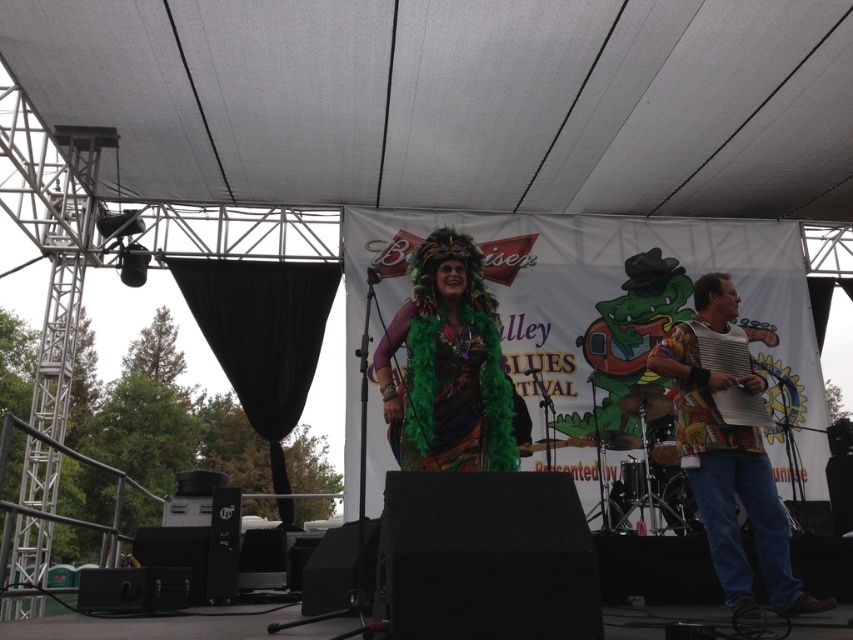
How far apart are printed fabric accordion at right and textured yellow accordion at center?

printed fabric accordion at right and textured yellow accordion at center are 7.83 inches apart.

Does point (740, 428) come closer to viewer compared to point (758, 410)?

Yes.

Is point (746, 492) positioned in front of point (767, 420)?

That is True.

Locate an element on the screen. printed fabric accordion at right is located at coordinates (728, 476).

Does multicolored feather boa at center have a lesser width compared to textured yellow accordion at center?

No.

Is multicolored feather boa at center below textured yellow accordion at center?

Incorrect, multicolored feather boa at center is not positioned below textured yellow accordion at center.

Image resolution: width=853 pixels, height=640 pixels. What do you see at coordinates (448, 365) in the screenshot?
I see `multicolored feather boa at center` at bounding box center [448, 365].

Image resolution: width=853 pixels, height=640 pixels. Identify the location of multicolored feather boa at center. (448, 365).

Between point (486, 378) and point (670, 353), which one is positioned behind?

Point (670, 353)

Measure the distance between multicolored feather boa at center and camera.

3.11 meters

Is point (444, 381) behind point (785, 544)?

That is False.

Locate an element on the screen. The width and height of the screenshot is (853, 640). multicolored feather boa at center is located at coordinates (448, 365).